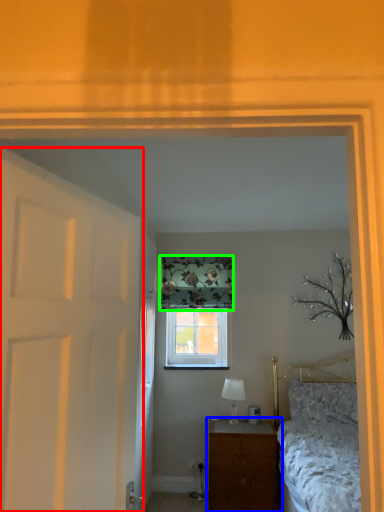
Question: Considering the real-world distances, which object is closest to door (highlighted by a red box)? nightstand (highlighted by a blue box) or curtain (highlighted by a green box).

Choices:
 (A) nightstand
 (B) curtain

Answer: (A)